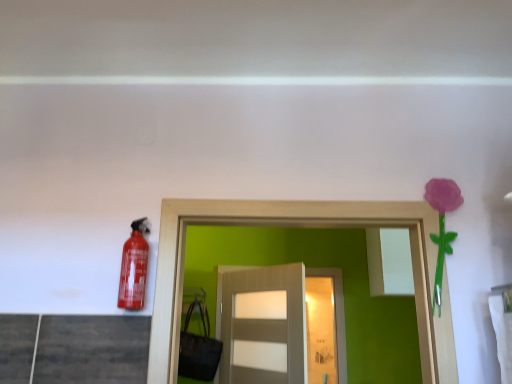
Image resolution: width=512 pixels, height=384 pixels. Find the location of `matte red extinguisher at left`. matte red extinguisher at left is located at coordinates (134, 268).

What is the approximate width of matte gray door at center?

matte gray door at center is 4.80 inches in width.

Identify the location of matte red extinguisher at left. (134, 268).

Would you say matte red extinguisher at left is to the left or to the right of matte gray door at center in the picture?

Based on their positions, matte red extinguisher at left is located to the left of matte gray door at center.

Considering the sizes of matte red extinguisher at left and matte gray door at center in the image, is matte red extinguisher at left bigger or smaller than matte gray door at center?

In the image, matte red extinguisher at left appears to be smaller than matte gray door at center.

Between matte red extinguisher at left and matte gray door at center, which one has less height?

Standing shorter between the two is matte red extinguisher at left.

Where is `extinguisher in front of the matte gray door at center`? extinguisher in front of the matte gray door at center is located at coordinates (134, 268).

Is matte red extinguisher at left inside matte gray door at center?

No, matte red extinguisher at left is not a part of matte gray door at center.

From the image's perspective, is matte gray door at center above or below matte red extinguisher at left?

matte gray door at center is situated lower than matte red extinguisher at left in the image.

Which object is further away from the camera, purple matte flower at upper right or matte red extinguisher at left?

Positioned behind is purple matte flower at upper right.

Considering the relative sizes of purple matte flower at upper right and matte red extinguisher at left in the image provided, is purple matte flower at upper right shorter than matte red extinguisher at left?

No, purple matte flower at upper right is not shorter than matte red extinguisher at left.

From the image's perspective, is purple matte flower at upper right above or below matte red extinguisher at left?

purple matte flower at upper right is situated higher than matte red extinguisher at left in the image.

Would you say purple matte flower at upper right is inside or outside matte red extinguisher at left?

purple matte flower at upper right cannot be found inside matte red extinguisher at left.

From a real-world perspective, is matte red extinguisher at left physically below purple matte flower at upper right?

Yes, from a real-world perspective, matte red extinguisher at left is below purple matte flower at upper right.

Is matte red extinguisher at left directly adjacent to purple matte flower at upper right?

No, matte red extinguisher at left is not next to purple matte flower at upper right.

Does matte red extinguisher at left have a greater width compared to purple matte flower at upper right?

Yes.

Is matte red extinguisher at left positioned beyond the bounds of purple matte flower at upper right?

Yes, matte red extinguisher at left is not within purple matte flower at upper right.

Is matte gray door at center wider than purple matte flower at upper right?

Yes, matte gray door at center is wider than purple matte flower at upper right.

Does matte gray door at center touch purple matte flower at upper right?

No, matte gray door at center is not making contact with purple matte flower at upper right.

How different are the orientations of matte gray door at center and purple matte flower at upper right in degrees?

They differ by 53.2 degrees in their facing directions.

From the picture: From the image's perspective, between purple matte flower at upper right and matte gray door at center, who is located below?

matte gray door at center appears lower in the image.

How far apart are purple matte flower at upper right and matte gray door at center?

purple matte flower at upper right and matte gray door at center are 1.54 meters apart from each other.

Which point is more distant from viewer, (430, 188) or (227, 282)?

The point (227, 282) is farther.

From a real-world perspective, is purple matte flower at upper right on matte gray door at center?

Indeed, from a real-world perspective, purple matte flower at upper right stands above matte gray door at center.

What are the coordinates of `extinguisher above the matte gray door at center (from a real-world perspective)` in the screenshot? It's located at (134, 268).

Locate an element on the screen. door that is under the matte red extinguisher at left (from a real-world perspective) is located at coordinates (263, 326).

Considering their positions, is purple matte flower at upper right positioned further to matte red extinguisher at left than matte gray door at center?

matte gray door at center is positioned further to the anchor matte red extinguisher at left.

Considering their positions, is matte red extinguisher at left positioned further to matte gray door at center than purple matte flower at upper right?

matte red extinguisher at left is positioned further to the anchor matte gray door at center.

When comparing their distances from matte gray door at center, does purple matte flower at upper right or matte red extinguisher at left seem further?

Based on the image, matte red extinguisher at left appears to be further to matte gray door at center.

When comparing their distances from matte red extinguisher at left, does matte gray door at center or purple matte flower at upper right seem closer?

purple matte flower at upper right is closer to matte red extinguisher at left.

When comparing their distances from purple matte flower at upper right, does matte gray door at center or matte red extinguisher at left seem further?

Among the two, matte gray door at center is located further to purple matte flower at upper right.

From the image, which object appears to be nearer to purple matte flower at upper right, matte red extinguisher at left or matte gray door at center?

Among the two, matte red extinguisher at left is located nearer to purple matte flower at upper right.

The width and height of the screenshot is (512, 384). I want to click on flower located between matte red extinguisher at left and matte gray door at center in the depth direction, so click(442, 225).